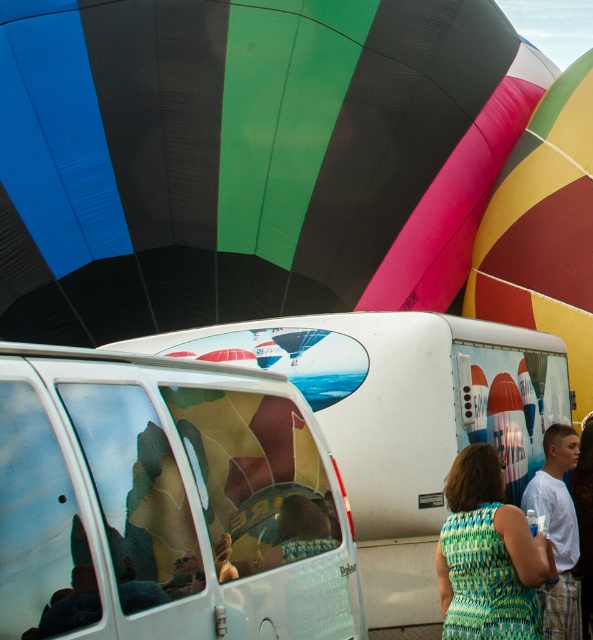
Question: Is green textured dress at lower right further to the viewer compared to light brown hair at center?

Choices:
 (A) no
 (B) yes

Answer: (A)

Question: Among these objects, which one is farthest from the camera?

Choices:
 (A) green textured dress at lower right
 (B) light brown hair at center

Answer: (B)

Question: Can you confirm if multicolored fabric balloon at upper center is wider than green textured dress at lower right?

Choices:
 (A) yes
 (B) no

Answer: (A)

Question: Considering the real-world distances, which object is closest to the rubberized yellow balloon at upper right?

Choices:
 (A) white cotton shirt at lower right
 (B) green textured dress at lower right
 (C) light brown hair at center

Answer: (C)

Question: Which is farther from the white glossy van at center?

Choices:
 (A) green textured dress at lower right
 (B) rubberized yellow balloon at upper right
 (C) light brown hair at center
 (D) multicolored fabric balloon at upper center

Answer: (B)

Question: Is white glossy minivan at center to the right of green textured dress at lower right from the viewer's perspective?

Choices:
 (A) yes
 (B) no

Answer: (B)